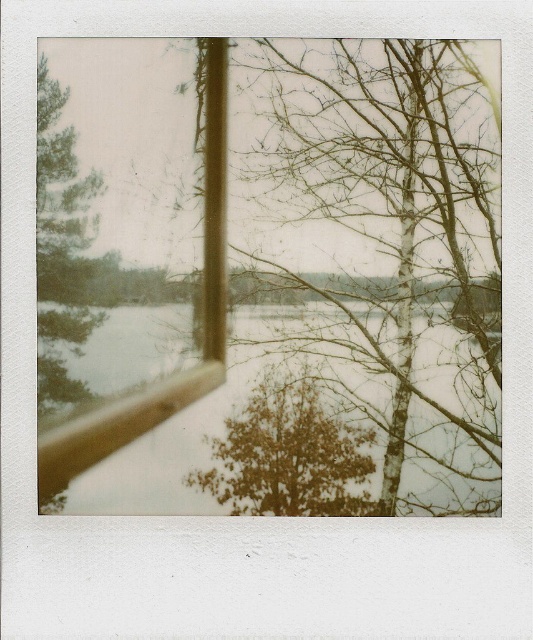
Looking at this image, you are standing inside a cozy room looking through a wooden window frame. You notice two points marked on the window. The first point is at coordinates point (362, 465) and the second point is at point (85, 301). Which point is closer to you?

Point (362, 465) is closer to the viewer than point (85, 301).

Looking at the wintry scene through the window, which tree is smaller between the brown textured tree at center and the green matte tree at left?

The brown textured tree at center is smaller than the green matte tree at left.

You are an interior designer planning to hang a small painting on the wall next to the wooden window frame. The painting must be placed at coordinates exactly matching the position of the bare wood tree at center in the image. Where should you place the painting relative to the wooden window frame?

The painting should be placed at coordinates exactly matching the position of the bare wood tree at center, which is at point 0.361 on the horizontal axis and 0.739 on the vertical axis relative to the wooden window frame.